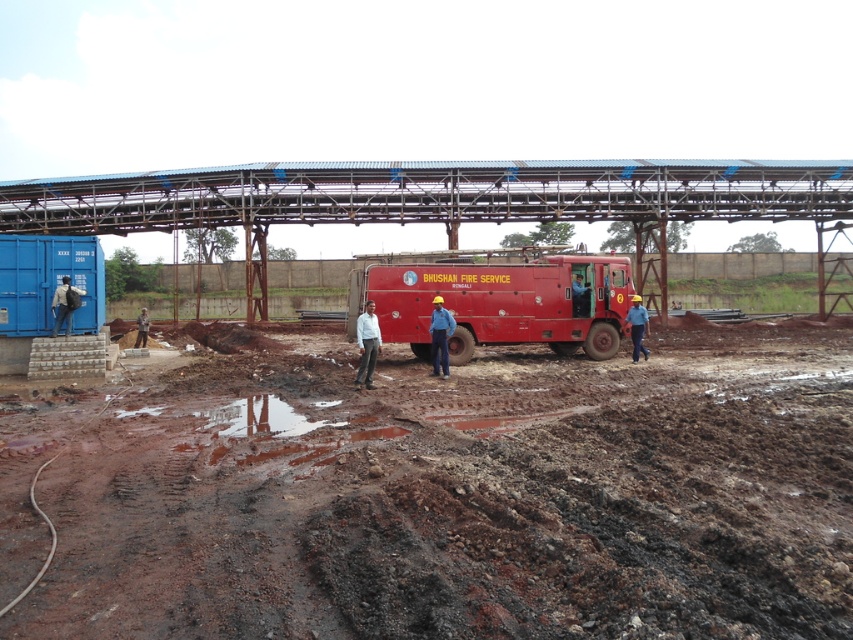
Find the location of `brown soil at center`. brown soil at center is located at coordinates (439, 493).

Which is behind, point (415, 618) or point (364, 301)?

Point (364, 301)

At what (x,y) coordinates should I click in order to perform the action: click on brown soil at center. Please return your answer as a coordinate pair (x, y). Image resolution: width=853 pixels, height=640 pixels. Looking at the image, I should click on (439, 493).

Does point (692, 365) come closer to viewer compared to point (639, 348)?

Yes, point (692, 365) is in front of point (639, 348).

Who is positioned more to the left, brown soil at center or matte blue uniform at center?

brown soil at center

This screenshot has width=853, height=640. What are the coordinates of `brown soil at center` in the screenshot? It's located at (439, 493).

Locate an element on the screen. This screenshot has width=853, height=640. brown soil at center is located at coordinates (439, 493).

Which is behind, point (364, 337) or point (445, 342)?

The point (445, 342) is behind.

Is white matte shirt at center bigger than hard hat at center?

No.

Is point (358, 380) closer to viewer compared to point (428, 330)?

Yes.

The width and height of the screenshot is (853, 640). I want to click on white matte shirt at center, so click(x=367, y=344).